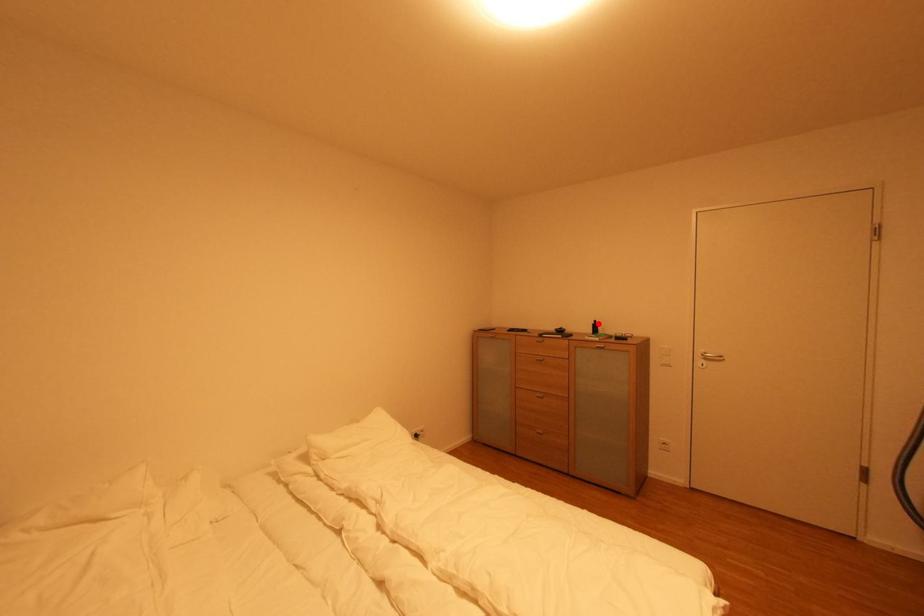
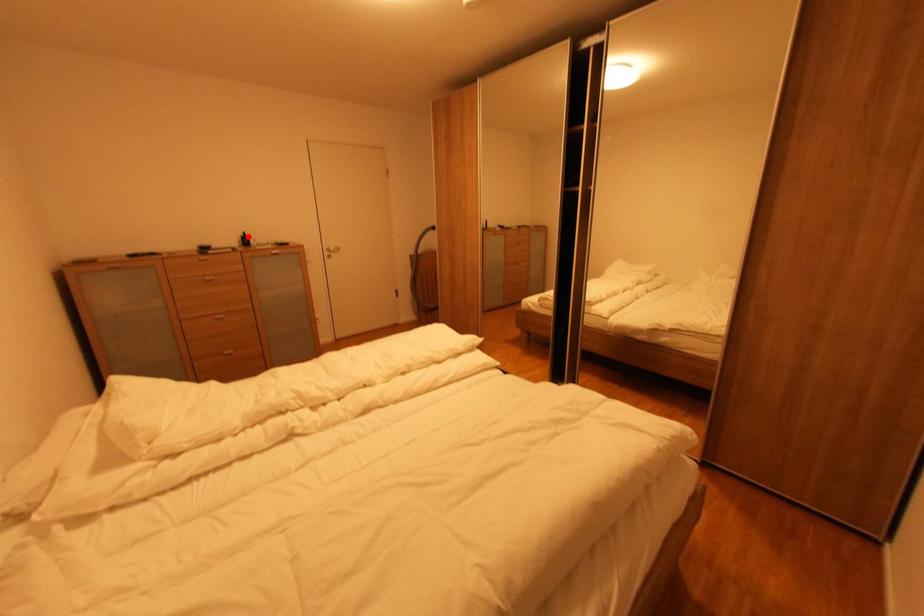
I am providing you with two images of the same scene from different viewpoints. A red point is marked on the first image and another point is marked on the second image. Are the points marked in image1 and image2 representing the same 3D position?

Yes